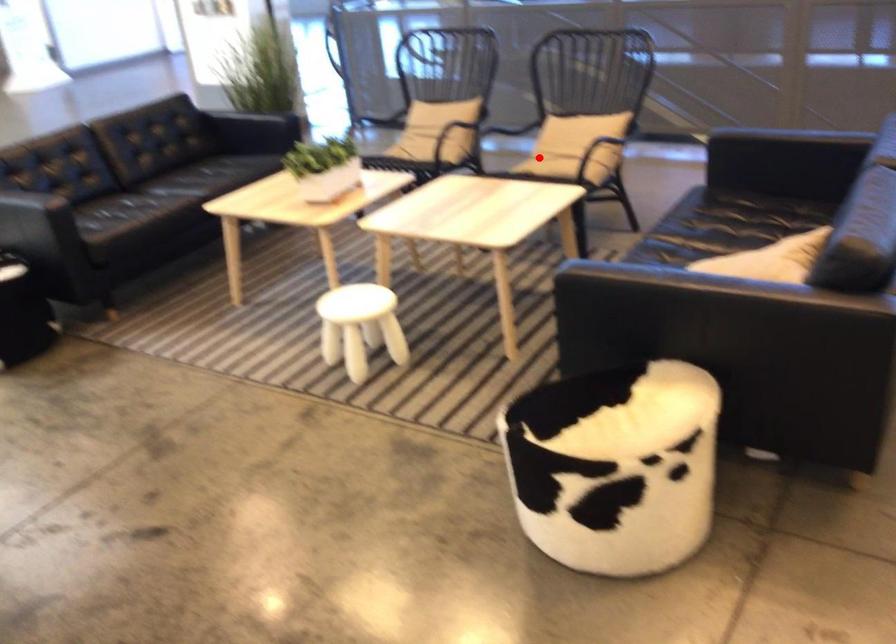
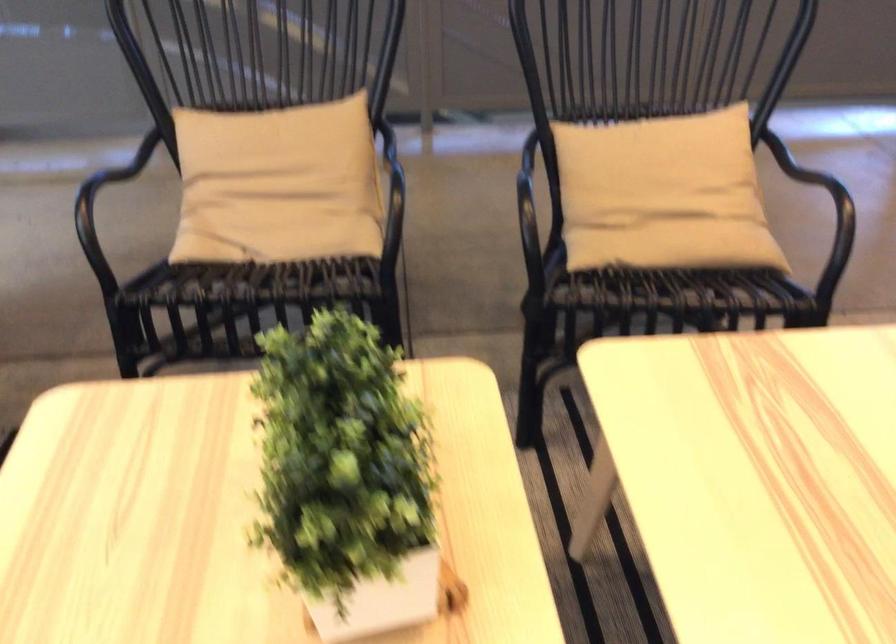
Question: I am providing you with two images of the same scene from different viewpoints. Image1 has a red point marked. In image2, the corresponding 3D location appears at what relative position? Reply with the corresponding letter.

Choices:
 (A) Closer
 (B) Farther

Answer: (A)